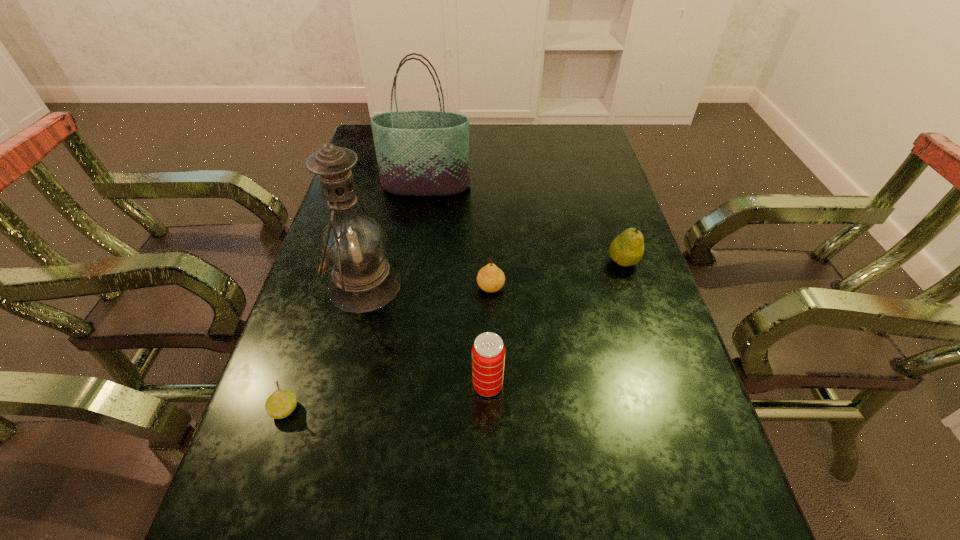
The height and width of the screenshot is (540, 960). Identify the location of vacant region located 0.350m on the back of the rightmost pear. (595, 176).

At what (x,y) coordinates should I click in order to perform the action: click on vacant space located 0.290m on the front of the second nearest pear. Please return your answer as a coordinate pair (x, y). Looking at the image, I should click on (493, 412).

Identify the location of vacant point located on the back of the nearest pear. (300, 366).

Where is `tote bag that is at the left edge`? The width and height of the screenshot is (960, 540). tote bag that is at the left edge is located at coordinates (419, 153).

The image size is (960, 540). Identify the location of oil lamp located at the left edge. (353, 245).

Locate an element on the screen. The image size is (960, 540). pear that is at the left edge is located at coordinates (280, 404).

Where is `object that is positioned at the right edge`? The height and width of the screenshot is (540, 960). object that is positioned at the right edge is located at coordinates (627, 249).

In the image, there is a desktop. In order to click on vacant space at the left edge in this screenshot , I will do `click(374, 165)`.

You are a GUI agent. You are given a task and a screenshot of the screen. Output one action in this format:
    pyautogui.click(x=<x>, y=<y>)
    Task: Click on the free spot at the right edge of the desktop
    
    Given the screenshot: What is the action you would take?
    pyautogui.click(x=614, y=368)

Locate an element on the screen. Image resolution: width=960 pixels, height=540 pixels. free region at the far left corner of the desktop is located at coordinates (372, 151).